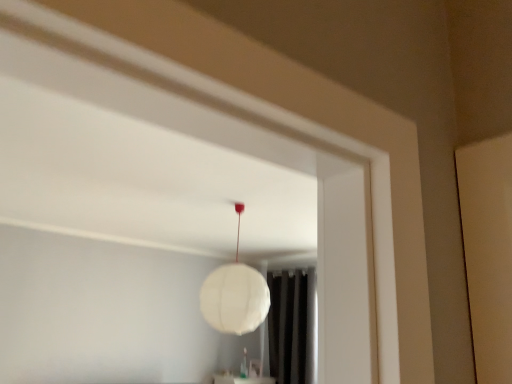
Question: Is point (307, 291) closer or farther from the camera than point (244, 304)?

Choices:
 (A) farther
 (B) closer

Answer: (A)

Question: Considering the positions of black fabric curtain at lower center and white paper lamp at center in the image, is black fabric curtain at lower center wider or thinner than white paper lamp at center?

Choices:
 (A) wide
 (B) thin

Answer: (B)

Question: Would you say black fabric curtain at lower center is to the left or to the right of white paper lamp at center in the picture?

Choices:
 (A) left
 (B) right

Answer: (B)

Question: Relative to black fabric curtain at lower center, is white paper lamp at center in front or behind?

Choices:
 (A) front
 (B) behind

Answer: (A)

Question: Is white paper lamp at center spatially inside black fabric curtain at lower center, or outside of it?

Choices:
 (A) inside
 (B) outside

Answer: (B)

Question: Is white paper lamp at center wider or thinner than black fabric curtain at lower center?

Choices:
 (A) wide
 (B) thin

Answer: (A)

Question: From their relative heights in the image, would you say white paper lamp at center is taller or shorter than black fabric curtain at lower center?

Choices:
 (A) tall
 (B) short

Answer: (B)